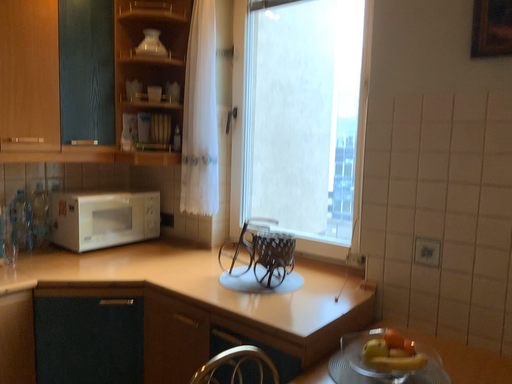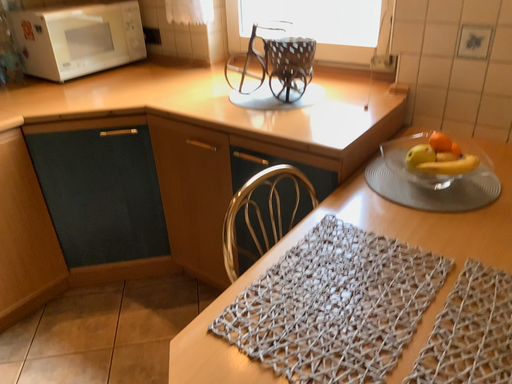
Question: How did the camera likely rotate when shooting the video?

Choices:
 (A) rotated downward
 (B) rotated upward

Answer: (A)